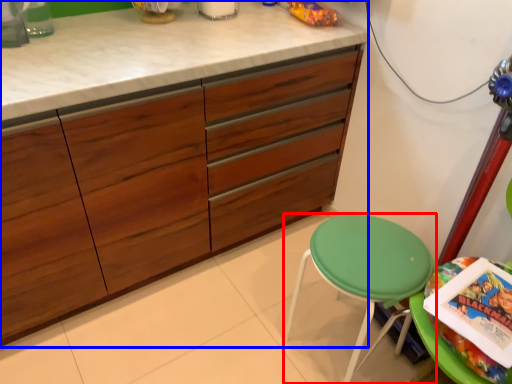
Question: Among these objects, which one is farthest to the camera, stool (highlighted by a red box) or cabinetry (highlighted by a blue box)?

Choices:
 (A) stool
 (B) cabinetry

Answer: (A)